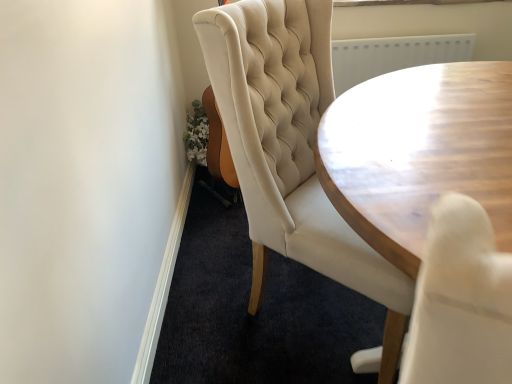
Question: Is point (257, 218) closer or farther from the camera than point (446, 185)?

Choices:
 (A) farther
 (B) closer

Answer: (A)

Question: Choose the correct answer: Is tufted cream chair at center inside wooden table at center or outside it?

Choices:
 (A) outside
 (B) inside

Answer: (A)

Question: From the image's perspective, is tufted cream chair at center above or below wooden table at center?

Choices:
 (A) above
 (B) below

Answer: (A)

Question: From a real-world perspective, is wooden table at center physically located above or below tufted cream chair at center?

Choices:
 (A) below
 (B) above

Answer: (B)

Question: Is wooden table at center in front of or behind tufted cream chair at center in the image?

Choices:
 (A) front
 (B) behind

Answer: (A)

Question: In terms of size, does wooden table at center appear bigger or smaller than tufted cream chair at center?

Choices:
 (A) big
 (B) small

Answer: (B)

Question: From the image's perspective, is wooden table at center located above or below tufted cream chair at center?

Choices:
 (A) below
 (B) above

Answer: (A)